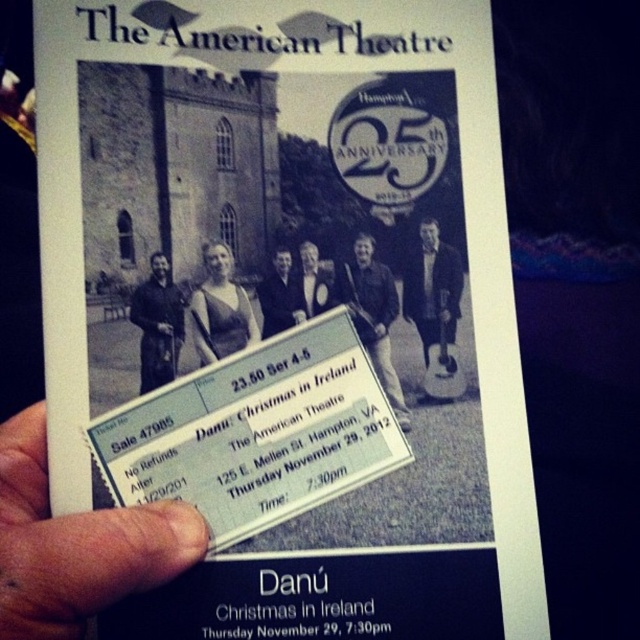
You are a costume designer analyzing the poster for historical accuracy. You notice the black leather jacket at center and the dark blue suit at center. Which clothing item appears larger in the image?

The black leather jacket at center is much taller than the dark blue suit at center, so it appears larger in the image.

You are attending an event at The American Theatre and notice two attendees dressed in a dark brown leather jacket at left and a dark blue suit at center. Which attendee is wearing a larger garment?

The dark brown leather jacket at left has a larger size compared to the dark blue suit at center, so the attendee wearing the dark brown leather jacket at left is wearing a larger garment.